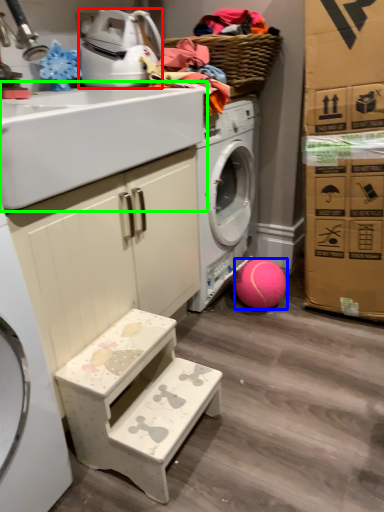
Question: Considering the real-world distances, which object is farthest from appliance (highlighted by a red box)? ball (highlighted by a blue box) or sink (highlighted by a green box)?

Choices:
 (A) ball
 (B) sink

Answer: (A)